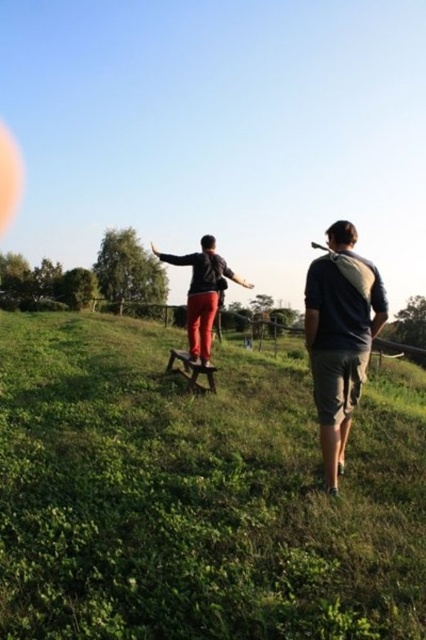
You are standing at point A and need to reach the wooden bench where the person is balancing. The coordinates of point A are unknown, but you know that the green grassy hillside at center is located at point B with coordinates (195, 497). If the wooden bench is on uneven terrain, which direction should you move from point B to reach the bench?

The wooden bench is on uneven terrain, but the green grassy hillside at center is at point B. Since the bench is part of the terrain, you should move towards the direction where the terrain becomes uneven from point B.

You are planning to take a photo of the dark gray cotton shirt at right and the matte black jacket at center. Which of the two objects should you focus on first to ensure both are in the frame and properly captured?

The dark gray cotton shirt at right has a smaller size compared to matte black jacket at center, so you should focus on the matte black jacket at center first to ensure both are in the frame and properly captured.

You are a photographer trying to capture both the dark gray cotton shirt at right and the matte black jacket at center in a single shot. Based on their positions, which one would appear closer to the bottom of the photo?

The dark gray cotton shirt at right appears closer to the bottom of the photo because it is located below the matte black jacket at center.